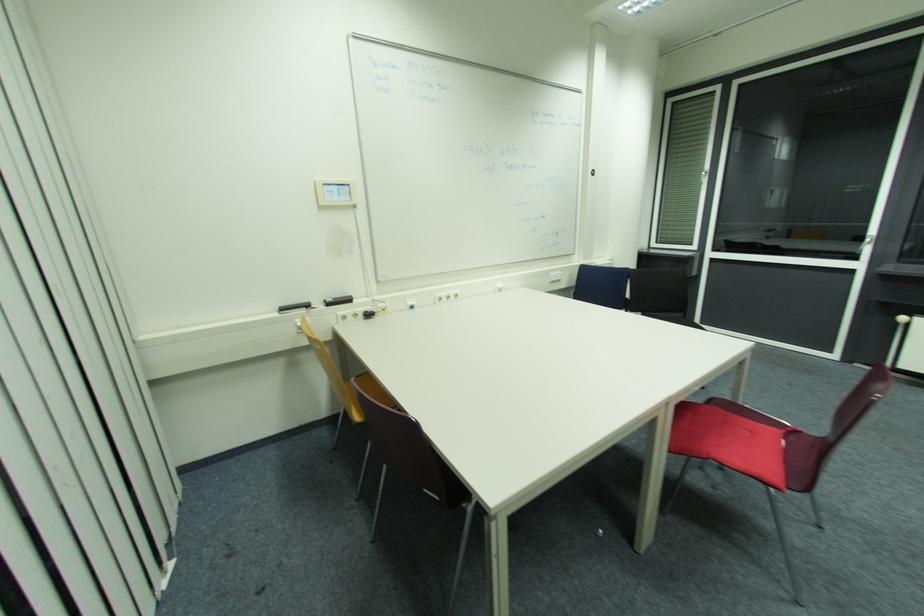
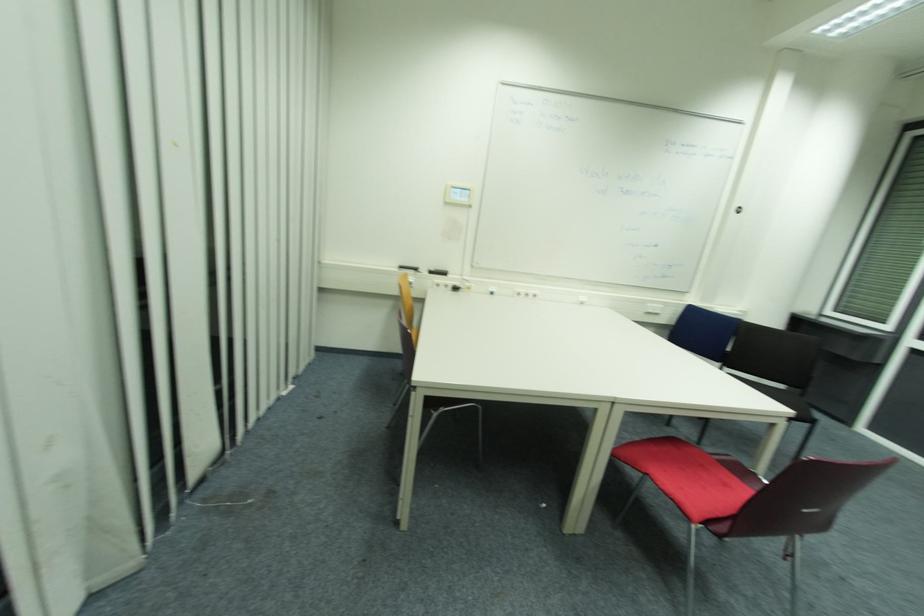
In the second image, find the point that corresponds to (453,299) in the first image.

(529, 294)